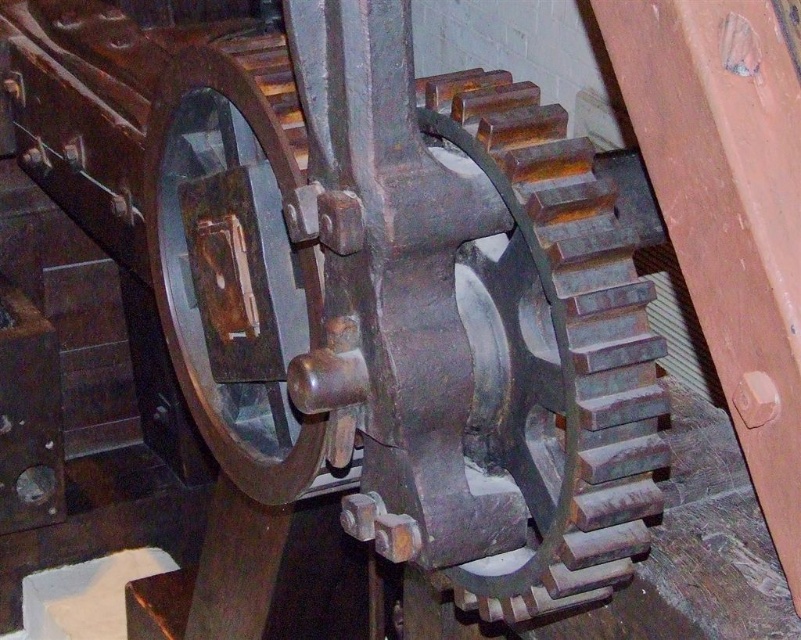
You are an engineer inspecting a gear system. You notice the rusty metal gear at center and another gear connected via a central shaft. How far apart are these two gears?

The two gears are 1.12 meters apart.

You are an engineer inspecting a gear system. You have a tool that measures 12 inches in length. You need to place it between the rusty metal gear at center and the metallic polished wheel at center to check the gap. Will the tool fit between them?

The distance between the rusty metal gear at center and the metallic polished wheel at center is 10.43 inches. Since the tool is 12 inches long, it is longer than the gap. Therefore, the tool will not fit between them.

You are an engineer inspecting a mechanical system. You notice two components at the center of your view, the rusty metal gear at center and the metallic polished wheel at center. Which of these two components takes up more space in your field of view?

The metallic polished wheel at center takes up more space in the field of view because the rusty metal gear at center occupies less space than the metallic polished wheel at center.